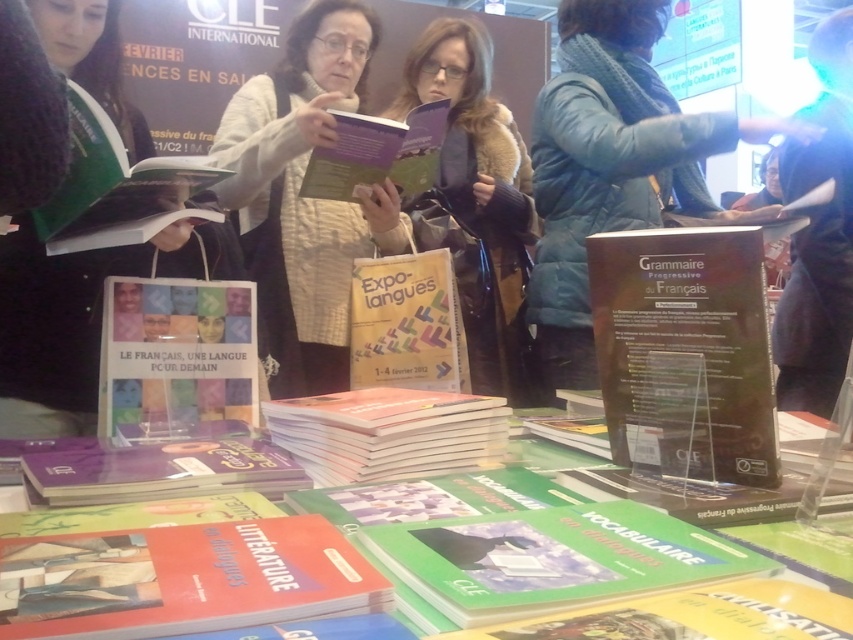
Question: Considering the real-world distances, which object is farthest from the orange matte book at lower left?

Choices:
 (A) orange matte book at center
 (B) purple matte book at lower left
 (C) multicolored paper bag at center
 (D) multicolored paper flyer at center

Answer: (D)

Question: Does blue puffy jacket at center have a larger size compared to orange matte book at center?

Choices:
 (A) yes
 (B) no

Answer: (A)

Question: Which point appears farthest from the camera in this image?

Choices:
 (A) click(45, 216)
 (B) click(323, 172)
 (C) click(463, 330)

Answer: (C)

Question: Which object is closer to the camera taking this photo?

Choices:
 (A) multicolored paper flyer at center
 (B) orange matte book at center

Answer: (B)

Question: Does white knitted sweater at center have a lesser width compared to purple matte book at center?

Choices:
 (A) yes
 (B) no

Answer: (B)

Question: Can you confirm if orange matte book at lower left is wider than purple matte book at center?

Choices:
 (A) no
 (B) yes

Answer: (A)